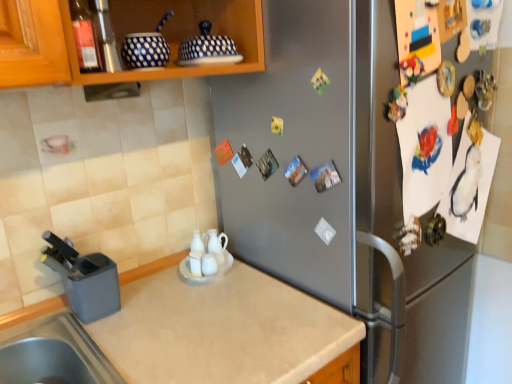
The image size is (512, 384). Describe the element at coordinates (217, 246) in the screenshot. I see `white glossy tea pot at center` at that location.

This screenshot has width=512, height=384. What do you see at coordinates (147, 48) in the screenshot?
I see `polka dot ceramic jar at upper center, acting as the second appliance starting from the bottom` at bounding box center [147, 48].

Find the location of a particular element. translucent glass bottle at upper left is located at coordinates (84, 37).

Find the location of `polka dot ceramic dish cover at upper center, which is the 3th appliance from left to right`. polka dot ceramic dish cover at upper center, which is the 3th appliance from left to right is located at coordinates (207, 48).

Between polka dot ceramic jar at upper center, the 2th appliance positioned from the top, and translucent glass bottle at upper left, which one is positioned behind?

Positioned behind is polka dot ceramic jar at upper center, the 2th appliance positioned from the top.

Which object is wider, polka dot ceramic jar at upper center, acting as the second appliance starting from the bottom, or translucent glass bottle at upper left?

polka dot ceramic jar at upper center, acting as the second appliance starting from the bottom, is wider.

Is polka dot ceramic jar at upper center, acting as the second appliance starting from the bottom, at the right side of translucent glass bottle at upper left?

Indeed, polka dot ceramic jar at upper center, acting as the second appliance starting from the bottom, is positioned on the right side of translucent glass bottle at upper left.

This screenshot has height=384, width=512. In order to click on bottle that appears on the left of polka dot ceramic jar at upper center, acting as the 2th appliance starting from the left in this screenshot , I will do `click(84, 37)`.

Which is more to the right, polka dot ceramic dish cover at upper center, which is the first appliance in top-to-bottom order, or translucent glass bottle at upper left?

Positioned to the right is polka dot ceramic dish cover at upper center, which is the first appliance in top-to-bottom order.

From a real-world perspective, is polka dot ceramic dish cover at upper center, the first appliance positioned from the right, positioned under translucent glass bottle at upper left based on gravity?

Indeed, from a real-world perspective, polka dot ceramic dish cover at upper center, the first appliance positioned from the right, is positioned beneath translucent glass bottle at upper left.

Which object is closer to the camera, polka dot ceramic dish cover at upper center, which is the 3th appliance from left to right, or translucent glass bottle at upper left?

translucent glass bottle at upper left is more forward.

In terms of height, does polka dot ceramic dish cover at upper center, which is the first appliance in top-to-bottom order, look taller or shorter compared to translucent glass bottle at upper left?

In the image, polka dot ceramic dish cover at upper center, which is the first appliance in top-to-bottom order, appears to be shorter than translucent glass bottle at upper left.

Considering the positions of point (214, 249) and point (460, 284), is point (214, 249) closer or farther from the camera than point (460, 284)?

Clearly, point (214, 249) is closer to the camera than point (460, 284).

Looking at this image, looking at their sizes, would you say white glossy tea pot at center is wider or thinner than satin silver fridge at center?

white glossy tea pot at center is thinner than satin silver fridge at center.

From a real-world perspective, is white glossy tea pot at center on top of satin silver fridge at center?

Yes, from a real-world perspective, white glossy tea pot at center is on top of satin silver fridge at center.

Is white glossy tea pot at center shorter than satin silver fridge at center?

Yes.

Which is closer, (83, 36) or (215, 55)?

Point (83, 36) is positioned closer to the camera compared to point (215, 55).

Are translucent glass bottle at upper left and polka dot ceramic dish cover at upper center, which is the 3th appliance from left to right, located far from each other?

No, translucent glass bottle at upper left is not far from polka dot ceramic dish cover at upper center, which is the 3th appliance from left to right.

Can you confirm if translucent glass bottle at upper left is shorter than polka dot ceramic dish cover at upper center, which is the first appliance in top-to-bottom order?

Incorrect, the height of translucent glass bottle at upper left does not fall short of that of polka dot ceramic dish cover at upper center, which is the first appliance in top-to-bottom order.

From a real-world perspective, is translucent glass bottle at upper left physically located above or below white glossy tea pot at center?

From a real-world perspective, translucent glass bottle at upper left is physically above white glossy tea pot at center.

How many degrees apart are the facing directions of translucent glass bottle at upper left and white glossy tea pot at center?

The facing directions of translucent glass bottle at upper left and white glossy tea pot at center are 2.59 degrees apart.

Based on the photo, does translucent glass bottle at upper left lie in front of white glossy tea pot at center?

Yes, translucent glass bottle at upper left is in front of white glossy tea pot at center.

Can you confirm if beige laminate countertop at lower left is taller than satin silver fridge at center?

No, beige laminate countertop at lower left is not taller than satin silver fridge at center.

Which is more to the left, beige laminate countertop at lower left or satin silver fridge at center?

beige laminate countertop at lower left is more to the left.

Which object is wider, beige laminate countertop at lower left or satin silver fridge at center?

satin silver fridge at center.

The height and width of the screenshot is (384, 512). I want to click on fridge on the right of beige laminate countertop at lower left, so click(x=339, y=184).

Is gray plastic knife block at lower left, the first appliance in the bottom-to-top sequence, completely or partially outside of white glossy tea pot at center?

gray plastic knife block at lower left, the first appliance in the bottom-to-top sequence, lies outside white glossy tea pot at center's area.

Is gray plastic knife block at lower left, which is the 1th appliance from left to right, oriented away from white glossy tea pot at center?

No, white glossy tea pot at center is not at the back of gray plastic knife block at lower left, which is the 1th appliance from left to right.

Which is less distant, (87, 256) or (222, 261)?

Point (87, 256).

From the picture: Considering their positions, is gray plastic knife block at lower left, which is the third appliance from top to bottom, located in front of or behind white glossy tea pot at center?

Clearly, gray plastic knife block at lower left, which is the third appliance from top to bottom, is in front of white glossy tea pot at center.

Locate an element on the screen. Image resolution: width=512 pixels, height=384 pixels. bottle above the polka dot ceramic jar at upper center, acting as the second appliance starting from the bottom (from a real-world perspective) is located at coordinates (84, 37).

Where is `appliance that is above the translucent glass bottle at upper left (from the image's perspective)`? The height and width of the screenshot is (384, 512). appliance that is above the translucent glass bottle at upper left (from the image's perspective) is located at coordinates (207, 48).

From the image, which object appears to be nearer to beige laminate countertop at lower left, translucent glass bottle at upper left or white glossy tea pot at center?

Based on the image, white glossy tea pot at center appears to be nearer to beige laminate countertop at lower left.

Looking at the image, which one is located closer to beige laminate countertop at lower left, gray plastic knife block at lower left, the first appliance in the bottom-to-top sequence, or white glossy tea pot at center?

Based on the image, gray plastic knife block at lower left, the first appliance in the bottom-to-top sequence, appears to be nearer to beige laminate countertop at lower left.

Considering their positions, is polka dot ceramic jar at upper center, acting as the 2th appliance starting from the left, positioned further to satin silver fridge at center than white glossy tea pot at center?

polka dot ceramic jar at upper center, acting as the 2th appliance starting from the left, lies further to satin silver fridge at center than the other object.

Considering their positions, is polka dot ceramic jar at upper center, acting as the 2th appliance starting from the left, positioned further to polka dot ceramic dish cover at upper center, which is the first appliance in top-to-bottom order, than translucent glass bottle at upper left?

translucent glass bottle at upper left is positioned further to the anchor polka dot ceramic dish cover at upper center, which is the first appliance in top-to-bottom order.

Based on the photo, estimate the real-world distances between objects in this image. Which object is further from polka dot ceramic dish cover at upper center, which is the first appliance in top-to-bottom order, white glossy tea pot at center or gray plastic knife block at lower left, positioned as the third appliance in right-to-left order?

gray plastic knife block at lower left, positioned as the third appliance in right-to-left order, is further to polka dot ceramic dish cover at upper center, which is the first appliance in top-to-bottom order.

Considering their positions, is white glossy tea pot at center positioned closer to polka dot ceramic dish cover at upper center, the first appliance positioned from the right, than translucent glass bottle at upper left?

translucent glass bottle at upper left is positioned closer to the anchor polka dot ceramic dish cover at upper center, the first appliance positioned from the right.

Looking at the image, which one is located closer to beige laminate countertop at lower left, satin silver fridge at center or polka dot ceramic jar at upper center, the 2th appliance positioned from the top?

satin silver fridge at center is closer to beige laminate countertop at lower left.

Estimate the real-world distances between objects in this image. Which object is further from white glossy tea pot at center, polka dot ceramic jar at upper center, acting as the 2th appliance starting from the left, or polka dot ceramic dish cover at upper center, which appears as the 3th appliance when ordered from the bottom?

polka dot ceramic jar at upper center, acting as the 2th appliance starting from the left.

Find the location of a particular element. Image resolution: width=512 pixels, height=384 pixels. appliance that lies between translucent glass bottle at upper left and gray plastic knife block at lower left, positioned as the third appliance in right-to-left order, from top to bottom is located at coordinates tap(147, 48).

Locate an element on the screen. fridge between beige laminate countertop at lower left and white glossy tea pot at center along the z-axis is located at coordinates (339, 184).

The width and height of the screenshot is (512, 384). Identify the location of countertop between gray plastic knife block at lower left, which is the third appliance from top to bottom, and satin silver fridge at center. (222, 329).

Identify the location of tea pot situated between gray plastic knife block at lower left, which is the 1th appliance from left to right, and satin silver fridge at center from left to right. (217, 246).